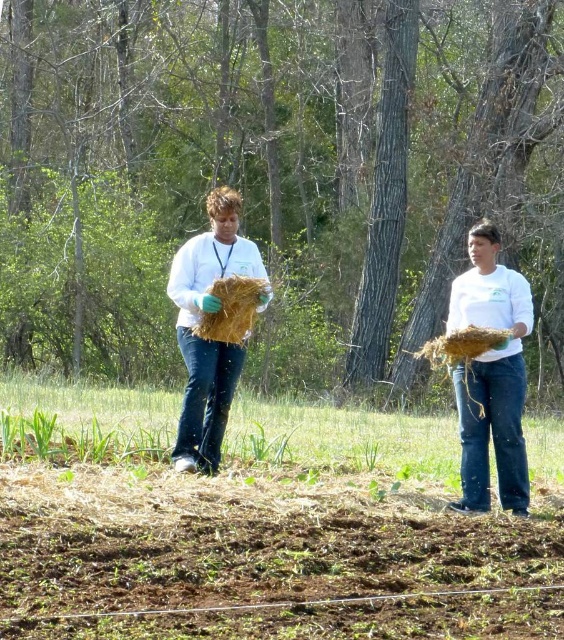
The width and height of the screenshot is (564, 640). Describe the element at coordinates (491, 376) in the screenshot. I see `white matte shirt at center` at that location.

Can you confirm if white matte shirt at center is bigger than matte straw bundle at center?

Correct, white matte shirt at center is larger in size than matte straw bundle at center.

Identify the location of white matte shirt at center. The height and width of the screenshot is (640, 564). (491, 376).

The height and width of the screenshot is (640, 564). Identify the location of white matte shirt at center. (491, 376).

Is white matte shirt at center wider than brown straw at center?

Yes, white matte shirt at center is wider than brown straw at center.

Does point (469, 492) come in front of point (210, 328)?

Yes, point (469, 492) is closer to viewer.

Identify the location of white matte shirt at center. The height and width of the screenshot is (640, 564). (491, 376).

Is brown soil at lower center closer to camera compared to white matte shirt at center?

Yes, it is in front of white matte shirt at center.

Is brown soil at lower center to the right of white matte shirt at center from the viewer's perspective?

No, brown soil at lower center is not to the right of white matte shirt at center.

Which is in front, point (233, 477) or point (487, 460)?

Positioned in front is point (487, 460).

Where is `brown soil at lower center`? This screenshot has width=564, height=640. brown soil at lower center is located at coordinates (262, 524).